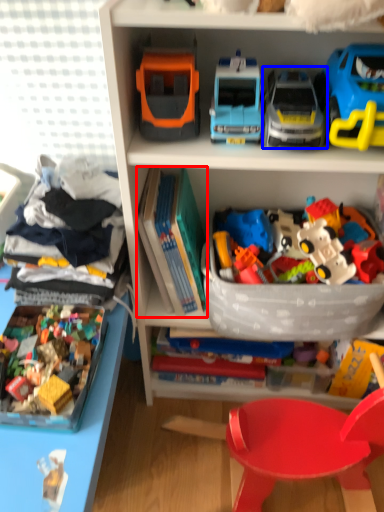
Question: Among these objects, which one is farthest to the camera, book (highlighted by a red box) or toy (highlighted by a blue box)?

Choices:
 (A) book
 (B) toy

Answer: (A)